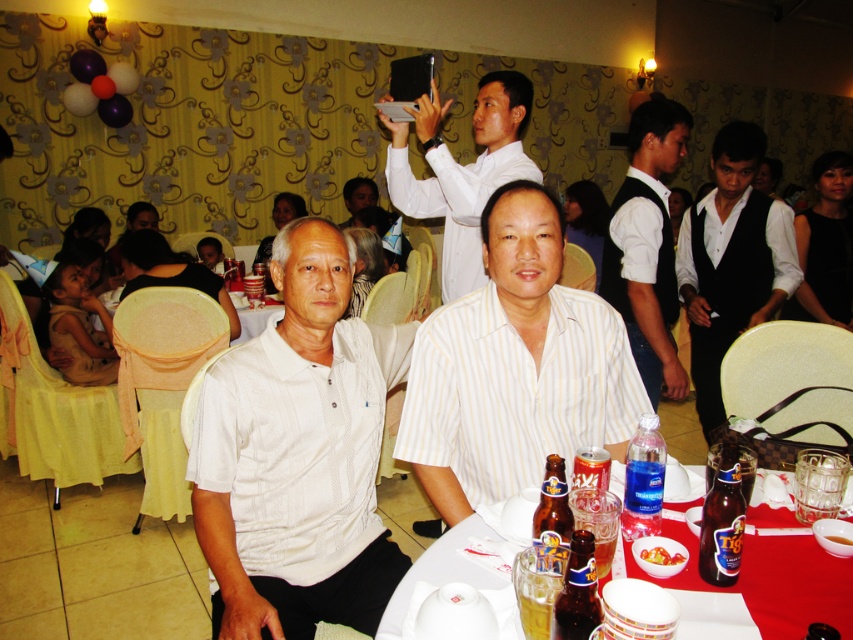
Question: Based on their relative distances, which object is farther from the white striped shirt at center?

Choices:
 (A) shiny gold beer at table center
 (B) brown glass bottle at lower right
 (C) smooth white bowl at center
 (D) white smooth shirt at upper center

Answer: (D)

Question: Which object appears farthest from the camera in this image?

Choices:
 (A) translucent plastic cups at lower center
 (B) translucent plastic bottle at table center
 (C) translucent glass bowl at upper center
 (D) shiny gold beer at table center

Answer: (B)

Question: Is black satin vest at right bigger than translucent plastic cups at lower center?

Choices:
 (A) no
 (B) yes

Answer: (B)

Question: Does white satin vest at right have a lesser width compared to translucent glass bottle at center?

Choices:
 (A) no
 (B) yes

Answer: (A)

Question: Which of the following is the farthest from the observer?

Choices:
 (A) (746, 243)
 (B) (830, 577)
 (C) (543, 524)
 (D) (828, 538)

Answer: (A)

Question: From the image, what is the correct spatial relationship of white textured polo shirt at center in relation to translucent glass bottle at center?

Choices:
 (A) below
 (B) above

Answer: (B)